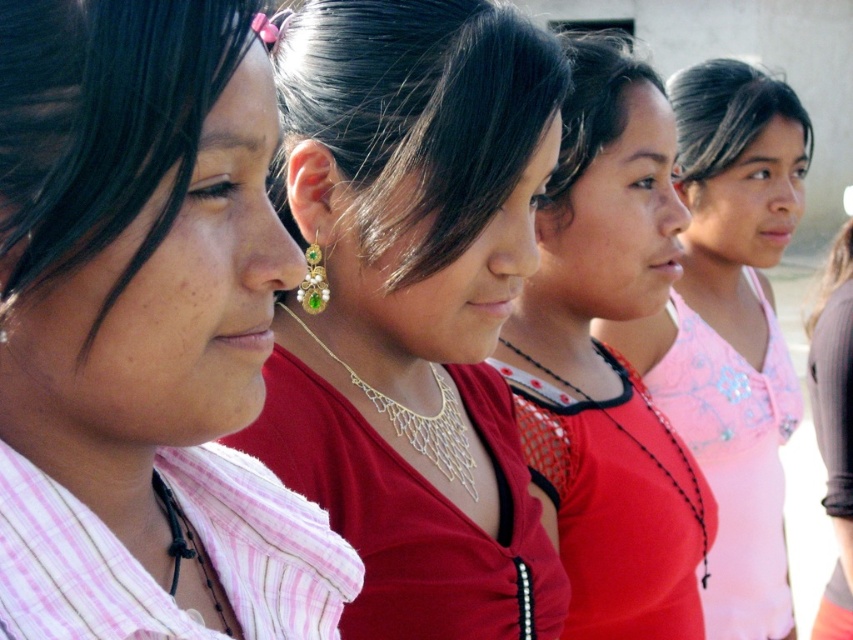
Is point (618, 488) positioned in front of point (706, 554)?

That is True.

The image size is (853, 640). Describe the element at coordinates (608, 358) in the screenshot. I see `matte red blouse at center` at that location.

Image resolution: width=853 pixels, height=640 pixels. I want to click on matte red blouse at center, so click(x=608, y=358).

Which is behind, point (688, 564) or point (366, 392)?

The point (688, 564) is behind.

At what (x,y) coordinates should I click in order to perform the action: click on red mesh dress at center. Please return your answer as a coordinate pair (x, y). Looking at the image, I should click on (618, 506).

Is point (766, 464) farther from viewer compared to point (386, 408)?

Yes, it is.

Can you confirm if pink fabric dress at right is positioned below gold metallic necklace at center?

Correct, pink fabric dress at right is located below gold metallic necklace at center.

Does point (694, 352) come behind point (434, 428)?

Yes, point (694, 352) is behind point (434, 428).

Locate an element on the screen. pink fabric dress at right is located at coordinates [735, 461].